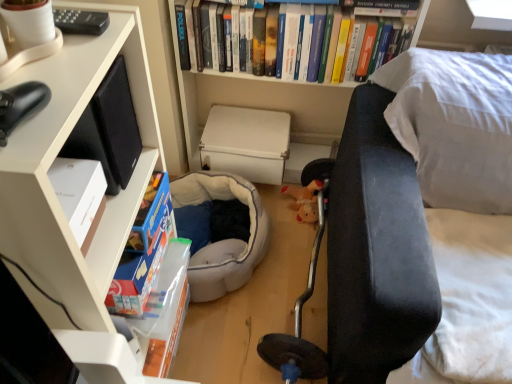
Question: Is white matte bookcase at left, the first bookcase when ordered from left to right, looking in the opposite direction of white matte box at center?

Choices:
 (A) no
 (B) yes

Answer: (A)

Question: Can you confirm if white matte bookcase at left, the first bookcase when ordered from left to right, is bigger than white matte box at center?

Choices:
 (A) yes
 (B) no

Answer: (A)

Question: Considering the relative sizes of white matte bookcase at left, the first bookcase when ordered from left to right, and white matte box at center in the image provided, is white matte bookcase at left, the first bookcase when ordered from left to right, thinner than white matte box at center?

Choices:
 (A) no
 (B) yes

Answer: (A)

Question: From the image's perspective, is white matte bookcase at left, placed as the second bookcase when sorted from back to front, over white matte box at center?

Choices:
 (A) no
 (B) yes

Answer: (A)

Question: Is white matte bookcase at left, placed as the second bookcase when sorted from back to front, at the left side of white matte box at center?

Choices:
 (A) yes
 (B) no

Answer: (A)

Question: Is white matte bookcase at left, the 2th bookcase viewed from the right, wider than white matte box at center?

Choices:
 (A) no
 (B) yes

Answer: (B)

Question: Is white matte bookcase at upper center, the first bookcase in the back-to-front sequence, aimed at white matte box at center?

Choices:
 (A) yes
 (B) no

Answer: (A)

Question: From a real-world perspective, is white matte bookcase at upper center, the first bookcase in the back-to-front sequence, on white matte box at center?

Choices:
 (A) yes
 (B) no

Answer: (A)

Question: Is white matte bookcase at upper center, the 1th bookcase viewed from the right, shorter than white matte box at center?

Choices:
 (A) yes
 (B) no

Answer: (B)

Question: Is white matte bookcase at upper center, placed as the 2th bookcase when sorted from front to back, bigger than white matte box at center?

Choices:
 (A) yes
 (B) no

Answer: (A)

Question: From a real-world perspective, is white matte bookcase at upper center, placed as the 2th bookcase when sorted from front to back, below white matte box at center?

Choices:
 (A) yes
 (B) no

Answer: (B)

Question: Is white matte bookcase at upper center, acting as the 2th bookcase starting from the left, closer to camera compared to white matte box at center?

Choices:
 (A) yes
 (B) no

Answer: (A)

Question: Is white matte box at center not near soft gray fabric bean bag at center?

Choices:
 (A) yes
 (B) no

Answer: (B)